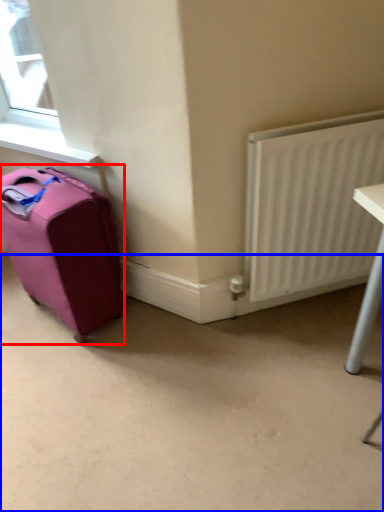
Question: Which of the following is the farthest to the observer, luggage and bags (highlighted by a red box) or concrete (highlighted by a blue box)?

Choices:
 (A) luggage and bags
 (B) concrete

Answer: (A)